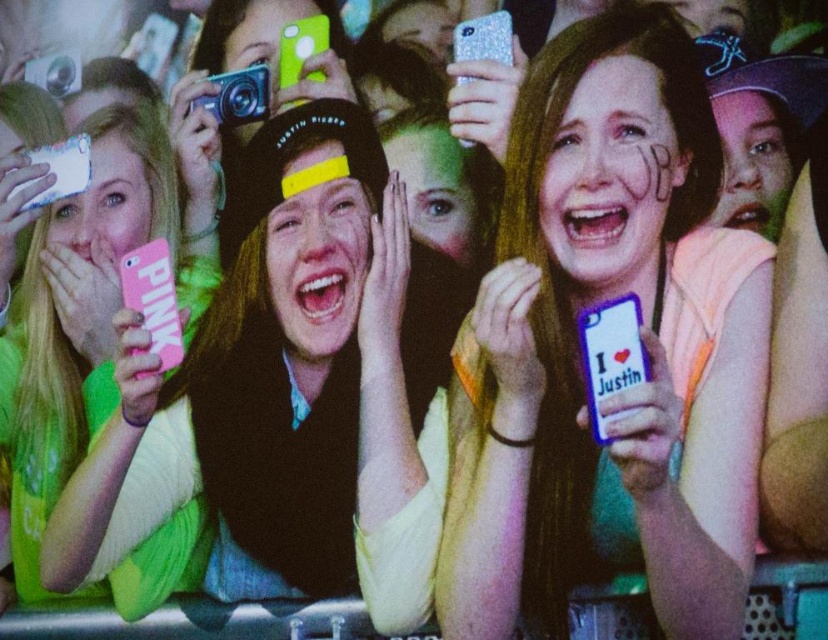
Question: Which of the following is the farthest from the observer?

Choices:
 (A) pink matte phone at left
 (B) white glossy phone at center
 (C) pink matte phone at center

Answer: (A)

Question: Does white glossy phone at center have a greater width compared to pink matte phone at center?

Choices:
 (A) yes
 (B) no

Answer: (B)

Question: Can you confirm if white glossy phone at center is positioned to the left of pink matte phone at left?

Choices:
 (A) yes
 (B) no

Answer: (B)

Question: Considering the real-world distances, which object is closest to the white glossy phone at center?

Choices:
 (A) pink matte phone at center
 (B) pink matte phone at left

Answer: (A)

Question: Can you confirm if pink matte phone at center is thinner than pink matte phone at left?

Choices:
 (A) yes
 (B) no

Answer: (B)

Question: Which of these objects is positioned farthest from the pink matte phone at center?

Choices:
 (A) pink matte phone at left
 (B) white glossy phone at center

Answer: (B)